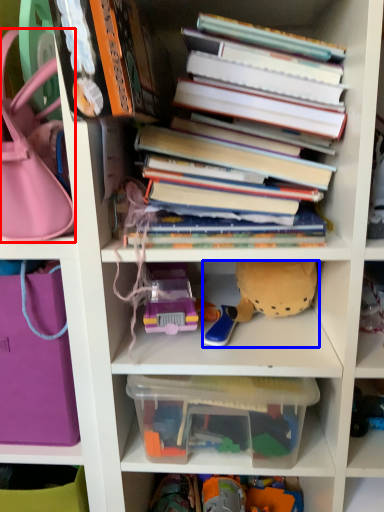
Question: Which object is closer to the camera taking this photo, handbag (highlighted by a red box) or toy (highlighted by a blue box)?

Choices:
 (A) handbag
 (B) toy

Answer: (A)